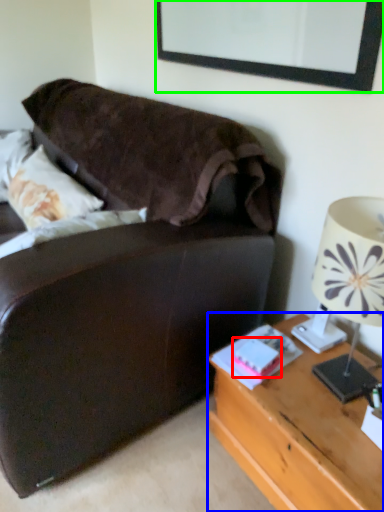
Question: Considering the real-world distances, which object is farthest from book (highlighted by a red box)? desk (highlighted by a blue box) or picture frame (highlighted by a green box)?

Choices:
 (A) desk
 (B) picture frame

Answer: (B)